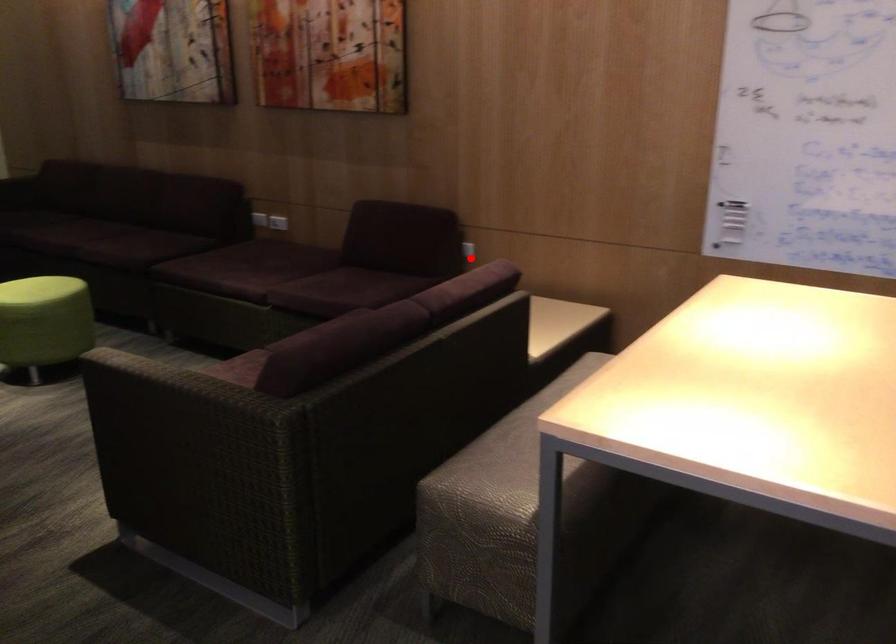
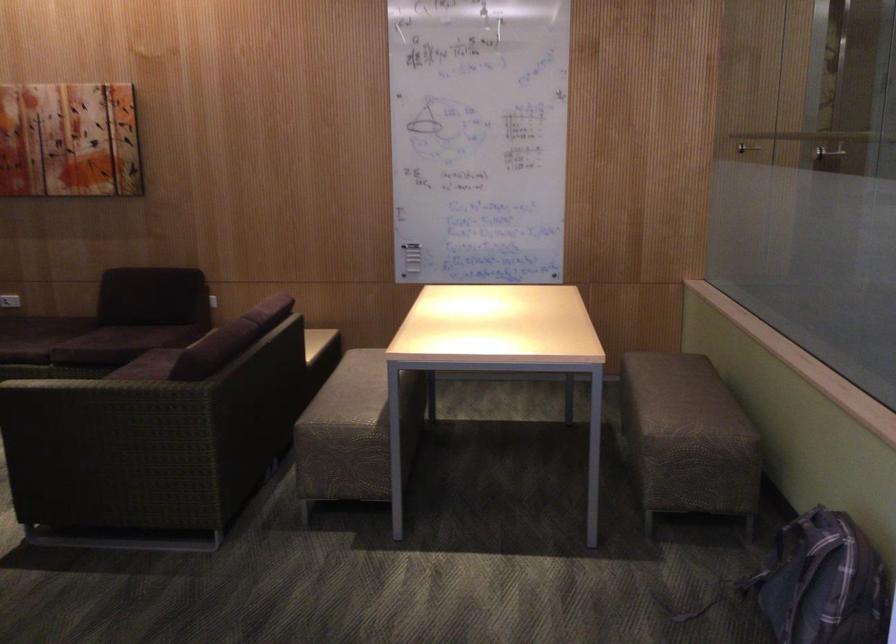
Question: A red point is marked in image1. In image2, is the corresponding 3D point closer to the camera or farther? Reply with the corresponding letter.

Choices:
 (A) The corresponding 3D point is closer.
 (B) The corresponding 3D point is farther.

Answer: (B)